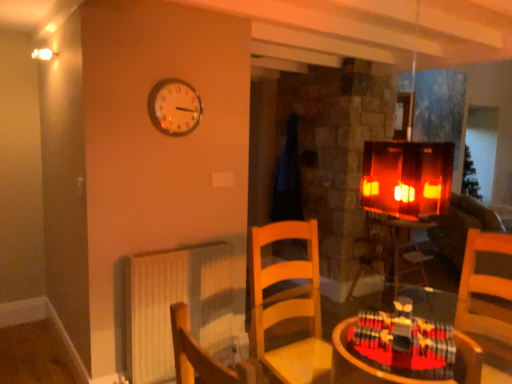
Question: Is wooden table at center, marked as the 1th table in a bottom-to-top arrangement, thinner than velvet brown couch at right?

Choices:
 (A) yes
 (B) no

Answer: (A)

Question: From a real-world perspective, is wooden table at center, placed as the 2th table when sorted from front to back, positioned over velvet brown couch at right based on gravity?

Choices:
 (A) no
 (B) yes

Answer: (B)

Question: From the image's perspective, is wooden table at center, placed as the 2th table when sorted from front to back, located beneath velvet brown couch at right?

Choices:
 (A) no
 (B) yes

Answer: (B)

Question: Is velvet brown couch at right surrounded by wooden table at center, placed as the 2th table when sorted from front to back?

Choices:
 (A) yes
 (B) no

Answer: (B)

Question: Is the position of wooden table at center, which is counted as the 1th table, starting from the back, less distant than that of velvet brown couch at right?

Choices:
 (A) no
 (B) yes

Answer: (B)

Question: Does point (355, 360) appear closer or farther from the camera than point (136, 321)?

Choices:
 (A) closer
 (B) farther

Answer: (A)

Question: From their relative heights in the image, would you say wooden table at lower right, which is the second table in back-to-front order, is taller or shorter than white textured radiator at lower left?

Choices:
 (A) tall
 (B) short

Answer: (B)

Question: Considering the positions of wooden table at lower right, which is the second table in back-to-front order, and white textured radiator at lower left in the image, is wooden table at lower right, which is the second table in back-to-front order, wider or thinner than white textured radiator at lower left?

Choices:
 (A) wide
 (B) thin

Answer: (A)

Question: From a real-world perspective, relative to white textured radiator at lower left, is wooden table at lower right, the second table viewed from the right, vertically above or below?

Choices:
 (A) above
 (B) below

Answer: (A)

Question: Is metallic round clock at upper center taller or shorter than wooden table at lower right, acting as the 1th table starting from the top?

Choices:
 (A) tall
 (B) short

Answer: (A)

Question: Considering the positions of point (196, 125) and point (457, 339), is point (196, 125) closer or farther from the camera than point (457, 339)?

Choices:
 (A) farther
 (B) closer

Answer: (A)

Question: In terms of size, does metallic round clock at upper center appear bigger or smaller than wooden table at lower right, which is counted as the first table, starting from the front?

Choices:
 (A) small
 (B) big

Answer: (A)

Question: From a real-world perspective, is metallic round clock at upper center physically located above or below wooden table at lower right, which is counted as the first table, starting from the front?

Choices:
 (A) below
 (B) above

Answer: (B)

Question: Do you think white textured radiator at lower left is within velvet brown couch at right, or outside of it?

Choices:
 (A) outside
 (B) inside

Answer: (A)

Question: From their relative heights in the image, would you say white textured radiator at lower left is taller or shorter than velvet brown couch at right?

Choices:
 (A) short
 (B) tall

Answer: (B)